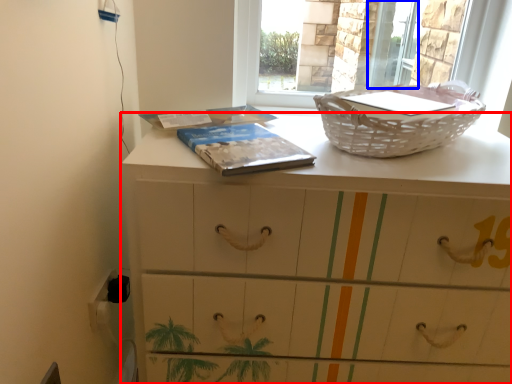
Question: Which object is closer to the camera taking this photo, chest of drawers (highlighted by a red box) or screen door (highlighted by a blue box)?

Choices:
 (A) chest of drawers
 (B) screen door

Answer: (A)